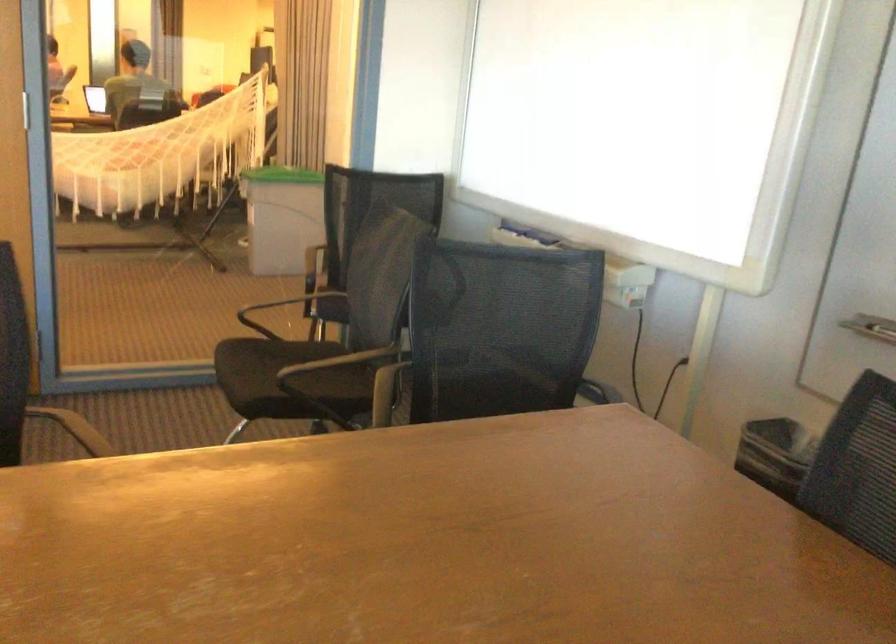
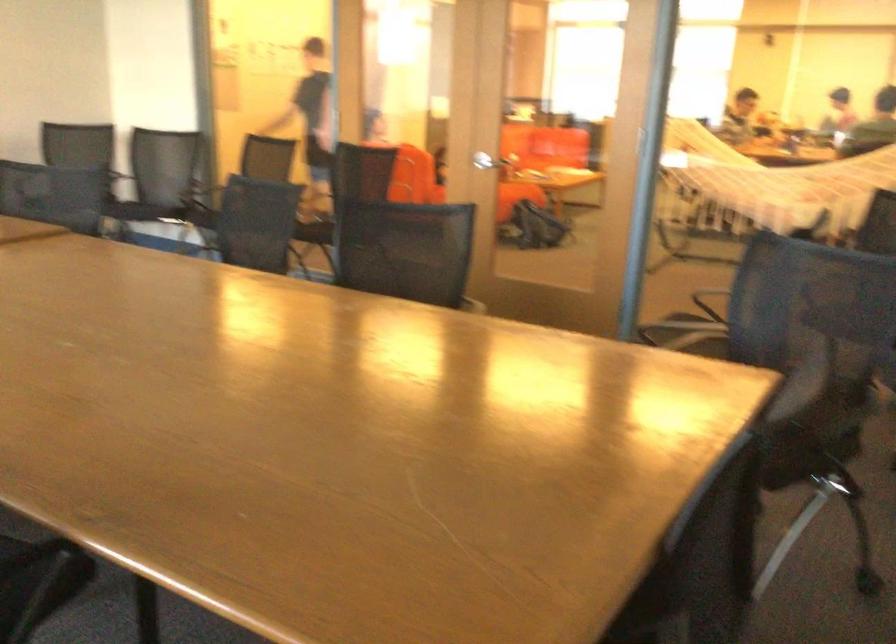
Question: I am providing you with two images of the same scene from different viewpoints. Please identify which objects are invisible in image2.

Choices:
 (A) silver floor lamp head
 (B) silver door handle
 (C) black chair armrest
 (D) white net hammock

Answer: (C)